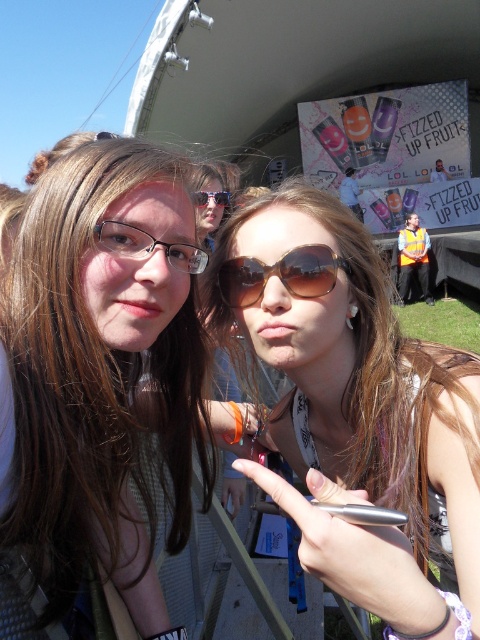
Can you confirm if brown matte sunglasses at center is thinner than shiny black sunglasses at center?

No, brown matte sunglasses at center is not thinner than shiny black sunglasses at center.

Find the location of a particular element. brown matte sunglasses at center is located at coordinates (356, 408).

Which is in front, point (180, 272) or point (196, 195)?

Point (180, 272) is more forward.

Can you confirm if matte black glasses at center is wider than shiny black sunglasses at center?

Yes.

Identify the location of matte black glasses at center. (147, 244).

Where is `matte black glasses at center`? matte black glasses at center is located at coordinates (147, 244).

Image resolution: width=480 pixels, height=640 pixels. What do you see at coordinates (280, 275) in the screenshot?
I see `sunglasses at center` at bounding box center [280, 275].

Locate an element on the screen. This screenshot has width=480, height=640. sunglasses at center is located at coordinates (280, 275).